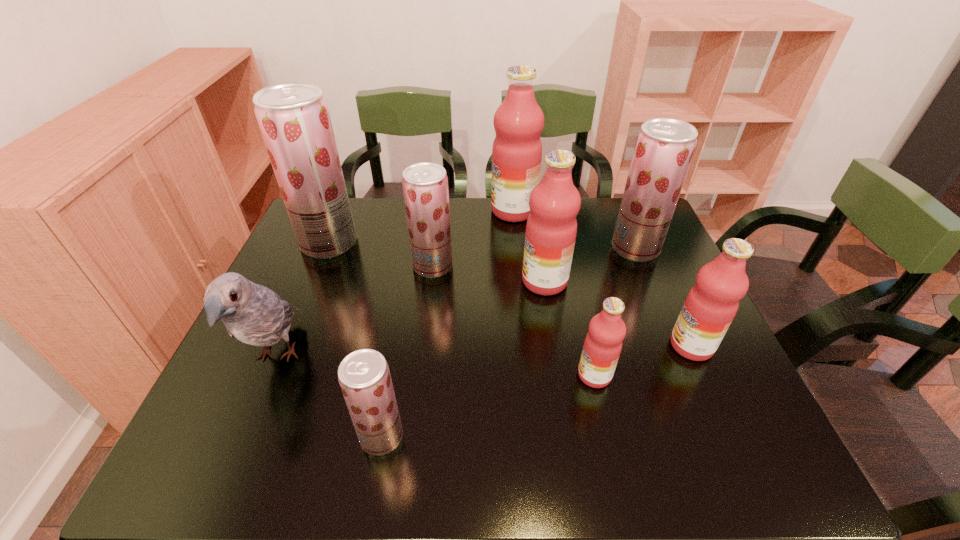
The width and height of the screenshot is (960, 540). In order to click on the farthest object in this screenshot , I will do pyautogui.click(x=518, y=122).

Image resolution: width=960 pixels, height=540 pixels. I want to click on the farthest fruit juice, so click(518, 122).

Identify the location of the leftmost strawberry fruit juice. The image size is (960, 540). (294, 120).

The height and width of the screenshot is (540, 960). I want to click on the leftmost fruit juice, so click(x=294, y=120).

Locate an element on the screen. This screenshot has height=540, width=960. the rightmost strawberry fruit juice is located at coordinates (664, 148).

Find the location of a particular element. the third smallest pink fruit juice is located at coordinates (551, 229).

Find the location of a particular element. The height and width of the screenshot is (540, 960). the second smallest strawberry fruit juice is located at coordinates (425, 185).

The image size is (960, 540). I want to click on the rightmost pink fruit juice, so click(x=712, y=303).

Find the location of a particular element. gray parrot is located at coordinates (254, 314).

Where is `the smallest pink fruit juice`? The height and width of the screenshot is (540, 960). the smallest pink fruit juice is located at coordinates [603, 343].